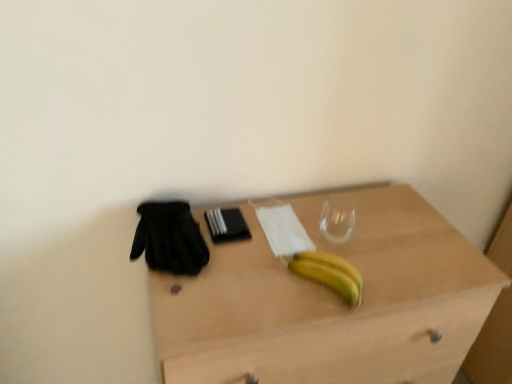
Locate an element on the screen. Image resolution: width=512 pixels, height=384 pixels. unoccupied space behind yellow matte banana at center is located at coordinates (332, 226).